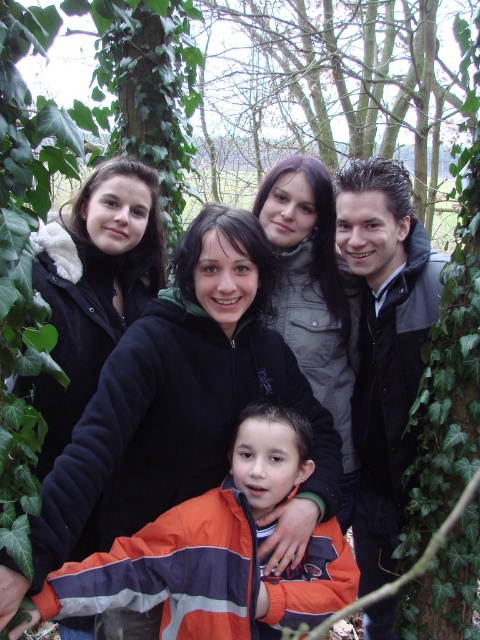
Based on the photo, you are organizing a group photo shoot in a wooded area. You have two jackets to place in the scene for visual interest. The orange fleece jacket at lower center and the black fuzzy jacket at upper left. Which jacket should you choose if you want the one that is wider to draw more attention?

The orange fleece jacket at lower center is wider than the black fuzzy jacket at upper left, so it would draw more attention due to its greater width.

You are a photographer trying to capture a candid shot of the orange fleece jacket at lower center without the black fuzzy jacket at upper left blocking the view. Given that your camera has a 24mm lens with a field of view of 84 degrees, can you estimate if the two jackets are within the same frame?

The distance between the orange fleece jacket at lower center and the black fuzzy jacket at upper left is 35.22 inches. With a 24mm lens providing an 84 degree field of view, this distance falls within the lens coverage, so they can be captured in the same frame.

You are a photographer trying to capture a photo of the group. You need to ensure that both the black fleece jacket at center and the black fuzzy jacket at upper left are in focus. Given that your camera can only focus on objects within a 60 cm range, will both jackets be in focus?

The distance between the black fleece jacket at center and the black fuzzy jacket at upper left is 64.27 centimeters. Since this exceeds the camera focus range of 60 cm, both jackets cannot be in focus simultaneously.